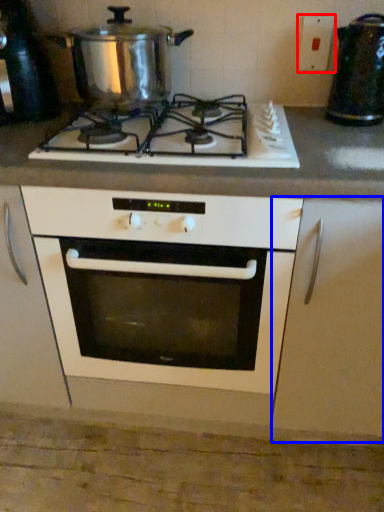
Question: Among these objects, which one is farthest to the camera, electric outlet (highlighted by a red box) or cabinetry (highlighted by a blue box)?

Choices:
 (A) electric outlet
 (B) cabinetry

Answer: (A)